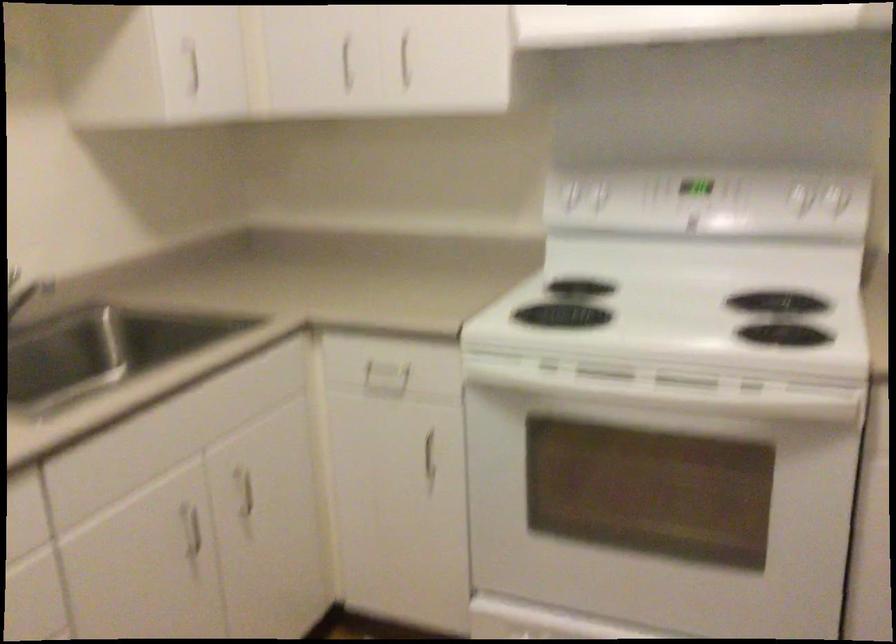
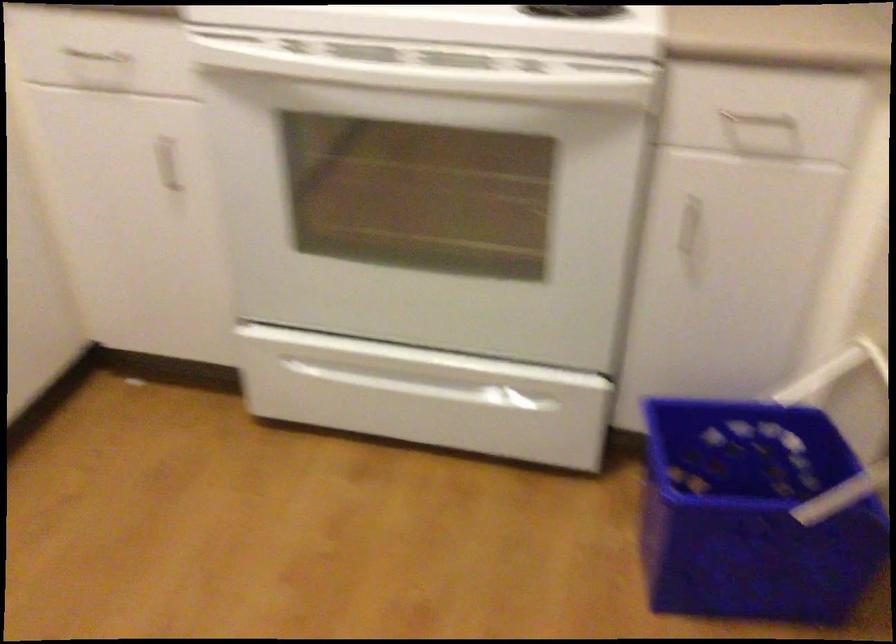
The point at (673, 388) is marked in the first image. Where is the corresponding point in the second image?

(437, 77)